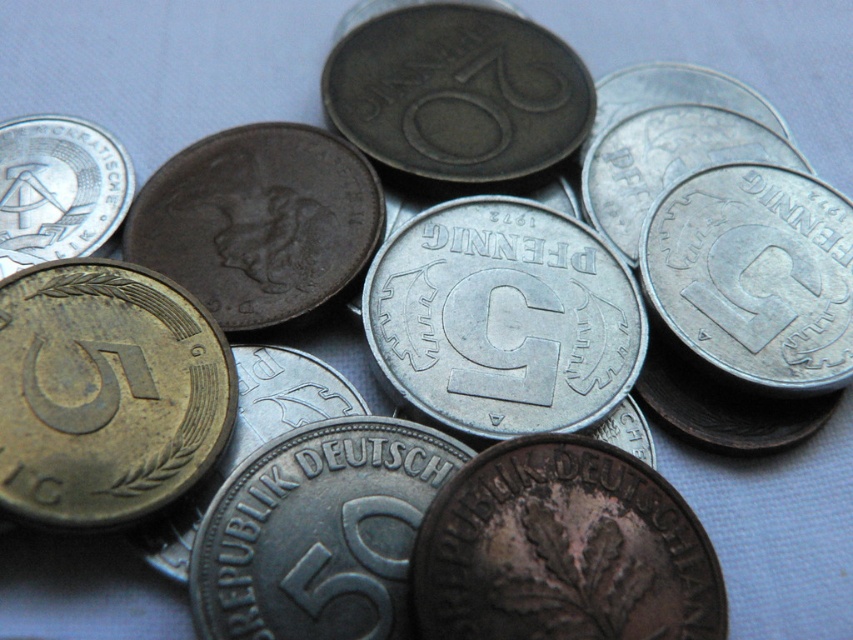
Between dark gray metallic coin at center and silver metallic coin at upper left, which one appears on the left side from the viewer's perspective?

silver metallic coin at upper left

Who is more distant from viewer, (323, 81) or (21, 180)?

Positioned behind is point (323, 81).

I want to click on dark gray metallic coin at center, so click(x=457, y=92).

Which is behind, point (96, 451) or point (323, 72)?

Positioned behind is point (323, 72).

Measure the distance between gold-bronze coin at center-left and camera.

They are 1.14 meters apart.

You are a GUI agent. You are given a task and a screenshot of the screen. Output one action in this format:
    pyautogui.click(x=<x>, y=<y>)
    Task: Click on the gold-bronze coin at center-left
    Image resolution: width=853 pixels, height=640 pixels.
    Given the screenshot: What is the action you would take?
    pyautogui.click(x=105, y=392)

Is gold-bronze coin at center-left above silver metallic coin at upper left?

No, gold-bronze coin at center-left is not above silver metallic coin at upper left.

Is gold-bronze coin at center-left below silver metallic coin at upper left?

Indeed, gold-bronze coin at center-left is positioned under silver metallic coin at upper left.

Who is more forward, (x=80, y=518) or (x=107, y=228)?

Positioned in front is point (x=80, y=518).

Identify the location of gold-bronze coin at center-left. (105, 392).